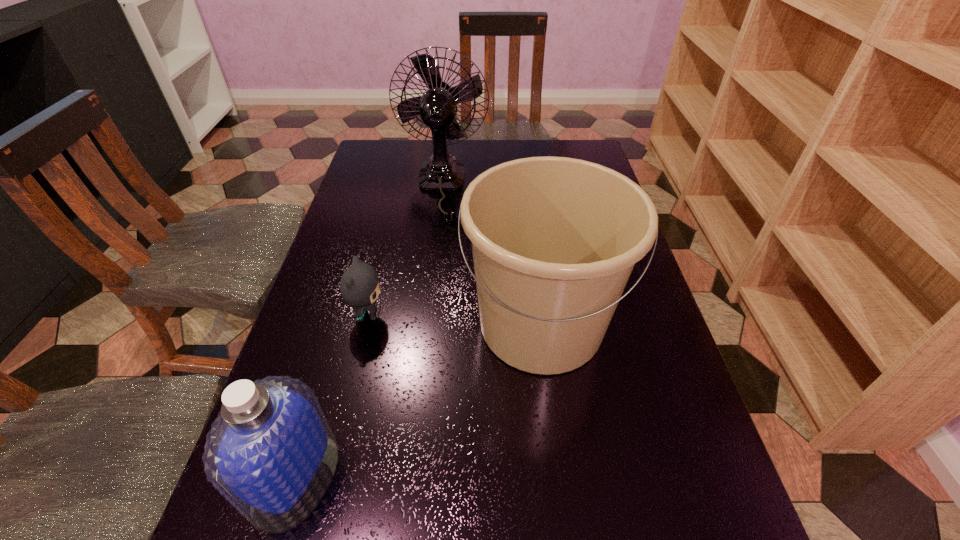
At what (x,y) coordinates should I click in order to perform the action: click on fan positioned at the left edge. Please return your answer as a coordinate pair (x, y). The width and height of the screenshot is (960, 540). Looking at the image, I should click on click(437, 108).

You are a GUI agent. You are given a task and a screenshot of the screen. Output one action in this format:
    pyautogui.click(x=<x>, y=<y>)
    Task: Click on the cleansing agent that is positioned at the left edge
    This screenshot has width=960, height=540.
    Given the screenshot: What is the action you would take?
    pyautogui.click(x=271, y=453)

The width and height of the screenshot is (960, 540). Find the location of `kitten situated at the left edge`. kitten situated at the left edge is located at coordinates (359, 285).

I want to click on object that is at the right edge, so coord(554,239).

Locate an element on the screen. object situated at the far left corner is located at coordinates (437, 108).

Locate an element on the screen. free space at the far edge of the desktop is located at coordinates (483, 148).

The width and height of the screenshot is (960, 540). What are the coordinates of `vacant space at the left edge` in the screenshot? It's located at (372, 255).

Image resolution: width=960 pixels, height=540 pixels. Identify the location of free region at the right edge. (638, 317).

In the image, there is a desktop. Find the location of `free region at the far left corner`. free region at the far left corner is located at coordinates (386, 176).

Locate an element on the screen. vacant area that lies between the fan and the kitten is located at coordinates (404, 251).